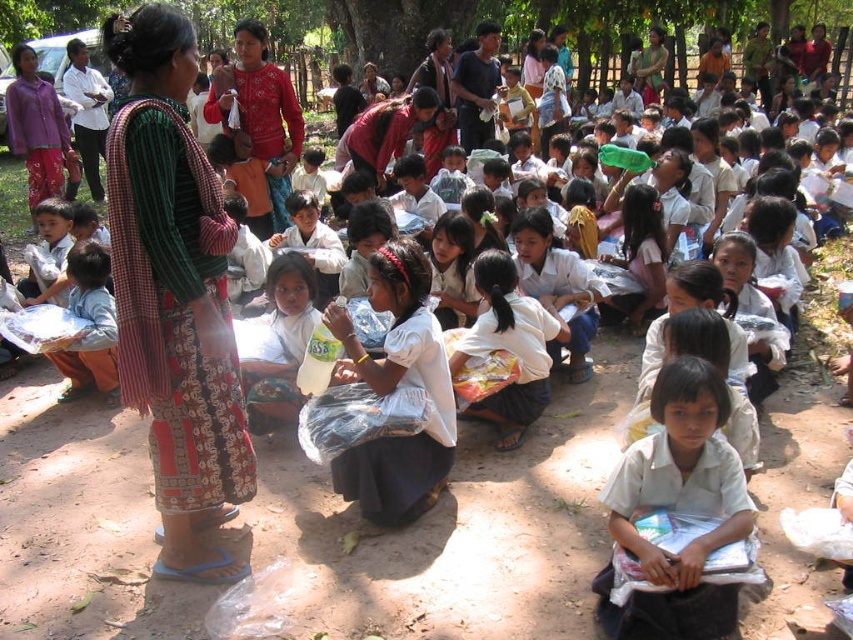
You are a teacher organizing an outdoor class and need to place a large poster between the green leafy tree at upper center and the red woven fabric at center. Which object should the poster be closer to to ensure it is visible under the tree?

The poster should be closer to the green leafy tree at upper center because it is larger and provides more shade, ensuring the poster remains visible under the tree.

Looking at this image, you are standing in the rural outdoor gathering scene. You need to locate the white cotton shirt at lower right. Where exactly is it positioned in the image?

The white cotton shirt at lower right is positioned at point [677,509] in the image.